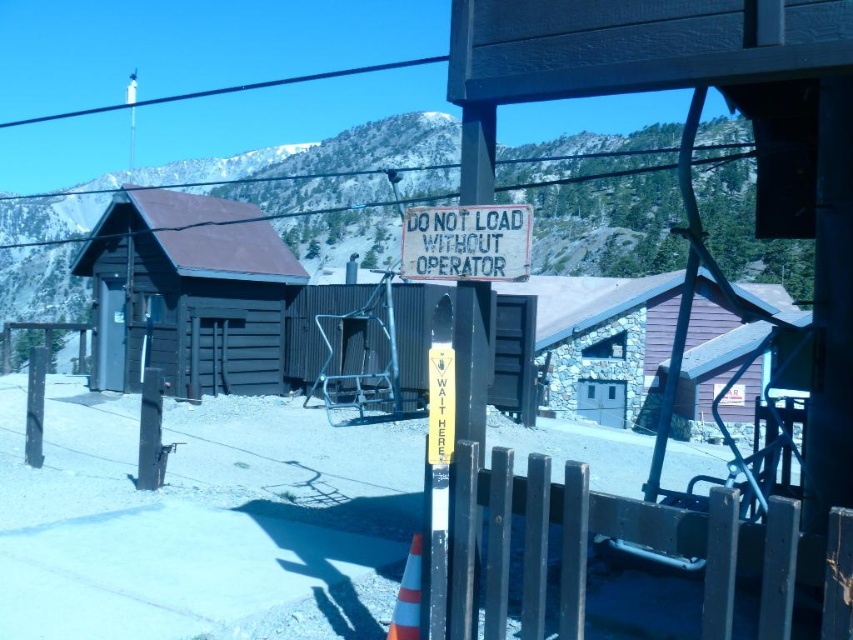
You are at the ski lift station and need to locate two points marked on the map. The first point is at coordinate point (538, 369) and the second is at point (415, 540). If you are facing the direction of the ski lift, which point would be closer to you?

Point (415, 540) is closer to you because it is in front of point (538, 369), which is behind it.

You are standing at the ski lift station and want to locate the dark brown wooden hut at center. According to the coordinates provided, where should you look to find it?

The dark brown wooden hut at center is located at coordinates point (189, 292).